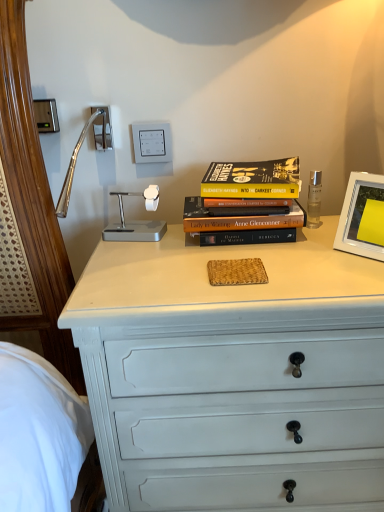
Locate an element on the screen. vacant space to the left of hardcover book at center is located at coordinates (149, 246).